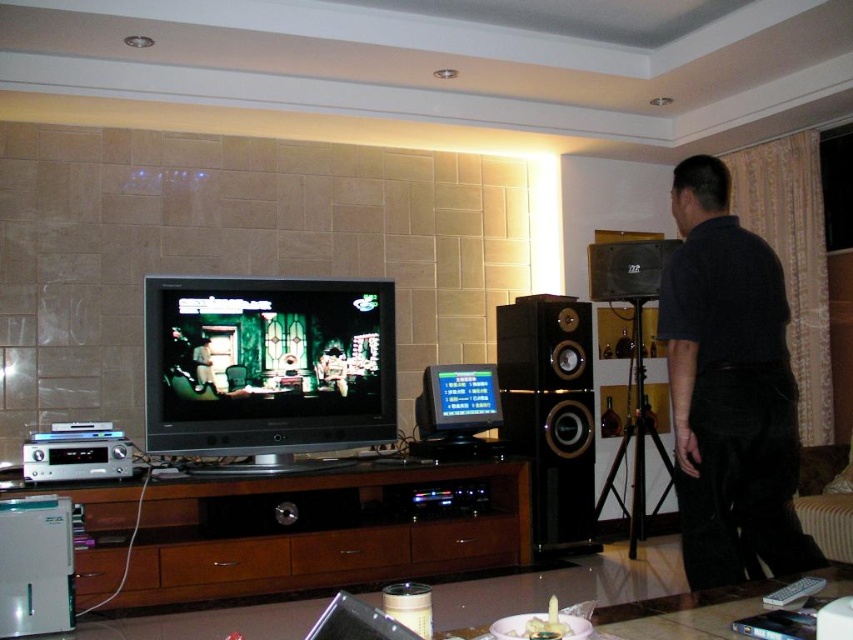
Does brown wood entertainment center at center have a lesser height compared to shiny black television at center?

Correct, brown wood entertainment center at center is not as tall as shiny black television at center.

Is brown wood entertainment center at center below shiny black television at center?

Correct, brown wood entertainment center at center is located below shiny black television at center.

Locate an element on the screen. The width and height of the screenshot is (853, 640). brown wood entertainment center at center is located at coordinates (297, 531).

Between dark blue shirt at center and shiny black television at center, which one appears on the left side from the viewer's perspective?

shiny black television at center is more to the left.

Which of these two, dark blue shirt at center or shiny black television at center, stands taller?

Standing taller between the two is dark blue shirt at center.

Between point (688, 243) and point (202, 308), which one is positioned in front?

Point (688, 243) is more forward.

Find the location of a particular element. The height and width of the screenshot is (640, 853). dark blue shirt at center is located at coordinates (729, 390).

Does shiny black television at center have a greater width compared to black wood speaker at center?

Correct, the width of shiny black television at center exceeds that of black wood speaker at center.

Who is shorter, shiny black television at center or black wood speaker at center?

shiny black television at center

The width and height of the screenshot is (853, 640). Find the location of `shiny black television at center`. shiny black television at center is located at coordinates tap(267, 365).

This screenshot has width=853, height=640. I want to click on shiny black television at center, so click(267, 365).